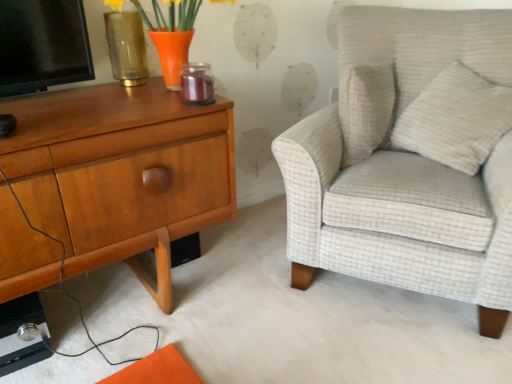
Question: Is matte gold vase at upper left to the left of orange glass vase at upper left from the viewer's perspective?

Choices:
 (A) no
 (B) yes

Answer: (B)

Question: Is matte gold vase at upper left wider than orange glass vase at upper left?

Choices:
 (A) yes
 (B) no

Answer: (B)

Question: Can you confirm if matte gold vase at upper left is thinner than orange glass vase at upper left?

Choices:
 (A) yes
 (B) no

Answer: (A)

Question: Does matte gold vase at upper left come behind orange glass vase at upper left?

Choices:
 (A) yes
 (B) no

Answer: (A)

Question: Does matte gold vase at upper left appear on the right side of orange glass vase at upper left?

Choices:
 (A) yes
 (B) no

Answer: (B)

Question: From the image's perspective, is white textured pillow at upper right above or below matte gold vase at upper left?

Choices:
 (A) above
 (B) below

Answer: (B)

Question: Would you say white textured pillow at upper right is inside or outside matte gold vase at upper left?

Choices:
 (A) outside
 (B) inside

Answer: (A)

Question: From a real-world perspective, is white textured pillow at upper right above or below matte gold vase at upper left?

Choices:
 (A) above
 (B) below

Answer: (B)

Question: Is white textured pillow at upper right taller or shorter than matte gold vase at upper left?

Choices:
 (A) tall
 (B) short

Answer: (A)

Question: From the image's perspective, is white textured pillow at upper right above or below orange glass vase at upper left?

Choices:
 (A) above
 (B) below

Answer: (B)

Question: Based on their sizes in the image, would you say white textured pillow at upper right is bigger or smaller than orange glass vase at upper left?

Choices:
 (A) big
 (B) small

Answer: (B)

Question: From a real-world perspective, is white textured pillow at upper right physically located above or below orange glass vase at upper left?

Choices:
 (A) below
 (B) above

Answer: (A)

Question: Considering the positions of white textured pillow at upper right and orange glass vase at upper left in the image, is white textured pillow at upper right taller or shorter than orange glass vase at upper left?

Choices:
 (A) tall
 (B) short

Answer: (A)

Question: Is light beige textured armchair at right bigger or smaller than woodennightstand at left?

Choices:
 (A) big
 (B) small

Answer: (A)

Question: From the image's perspective, relative to woodennightstand at left, is light beige textured armchair at right above or below?

Choices:
 (A) below
 (B) above

Answer: (B)